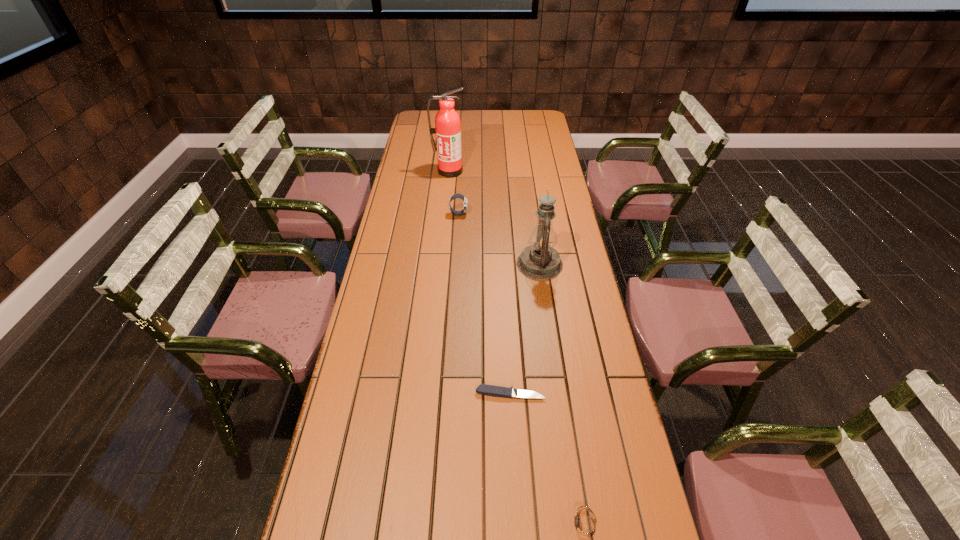
Locate an element on the screen. This screenshot has width=960, height=540. blank region between the fire extinguisher and the fourth farthest object is located at coordinates (480, 282).

The image size is (960, 540). Identify the location of unoccupied area between the farthest object and the steak knife. (480, 282).

At what (x,y) coordinates should I click in order to perform the action: click on free space between the fourth shortest object and the third shortest object. Please return your answer as a coordinate pair (x, y). Image resolution: width=960 pixels, height=540 pixels. Looking at the image, I should click on (499, 239).

Point out which object is positioned as the third nearest to the third farthest object. Please provide its 2D coordinates. Your answer should be formatted as a tuple, i.e. [(x, y)], where the tuple contains the x and y coordinates of a point satisfying the conditions above.

[(447, 128)]

Point out which object is positioned as the third nearest to the third tallest object. Please provide its 2D coordinates. Your answer should be formatted as a tuple, i.e. [(x, y)], where the tuple contains the x and y coordinates of a point satisfying the conditions above.

[(496, 391)]

Where is `vacant space that satisfies the following two spatial constraints: 1. on the back side of the oil lamp; 2. on the left side of the second nearest object`? vacant space that satisfies the following two spatial constraints: 1. on the back side of the oil lamp; 2. on the left side of the second nearest object is located at coordinates (503, 264).

Find the location of a particular element. The width and height of the screenshot is (960, 540). free space that satisfies the following two spatial constraints: 1. on the back side of the fourth farthest object; 2. on the face of the left watch is located at coordinates (500, 214).

Image resolution: width=960 pixels, height=540 pixels. What are the coordinates of `vacant position in the image that satisfies the following two spatial constraints: 1. on the label side of the third farthest object; 2. on the left side of the fire extinguisher` in the screenshot? It's located at (440, 264).

Locate an element on the screen. The image size is (960, 540). vacant area that satisfies the following two spatial constraints: 1. on the face of the third nearest object; 2. on the left side of the left watch is located at coordinates (456, 264).

Find the location of `free spot that satisfies the following two spatial constraints: 1. on the label side of the fourth shortest object; 2. on the right side of the fire extinguisher`. free spot that satisfies the following two spatial constraints: 1. on the label side of the fourth shortest object; 2. on the right side of the fire extinguisher is located at coordinates (440, 264).